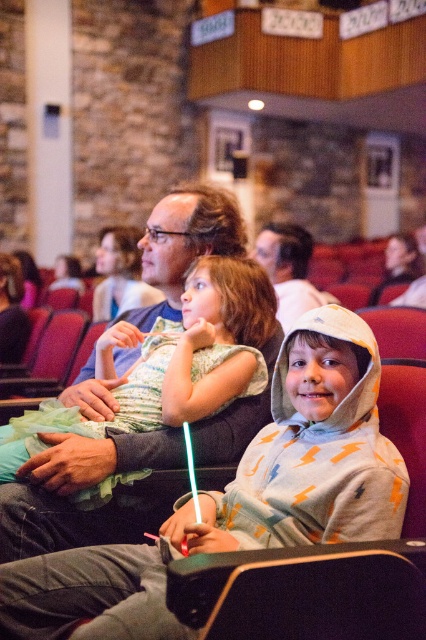
In the scene shown: Is matte green dress at center above matte brown hair at center?

Incorrect, matte green dress at center is not positioned above matte brown hair at center.

Who is more forward, (161, 356) or (195, 188)?

Point (161, 356)

Identify the location of matte green dress at center. This screenshot has height=640, width=426. (195, 349).

Who is taller, light gray hoodie at center or matte green dress at center?

matte green dress at center

Does light gray hoodie at center have a smaller size compared to matte green dress at center?

No.

Is point (374, 353) positioned in front of point (183, 374)?

That is True.

Where is `light gray hoodie at center`? light gray hoodie at center is located at coordinates (310, 452).

Which is more to the left, light gray hoodie at center or matte brown hair at center?

matte brown hair at center is more to the left.

Between light gray hoodie at center and matte brown hair at center, which one appears on the right side from the viewer's perspective?

From the viewer's perspective, light gray hoodie at center appears more on the right side.

You are a GUI agent. You are given a task and a screenshot of the screen. Output one action in this format:
    pyautogui.click(x=<x>, y=<y>)
    Task: Click on the light gray hoodie at center
    
    Given the screenshot: What is the action you would take?
    pyautogui.click(x=310, y=452)